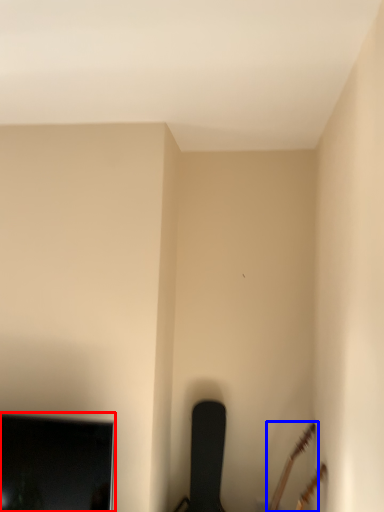
Question: Which object appears closest to the camera in this image, television (highlighted by a red box) or guitar (highlighted by a blue box)?

Choices:
 (A) television
 (B) guitar

Answer: (A)